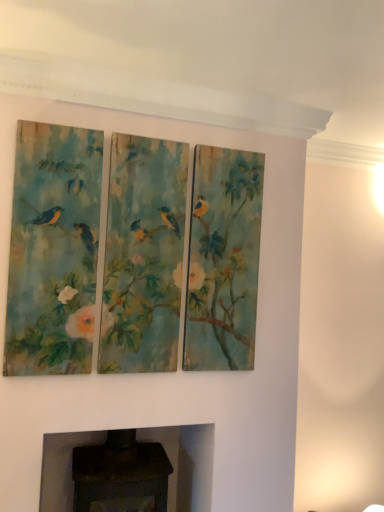
Question: Should I look upward or downward to see dark gray stone fireplace at lower center?

Choices:
 (A) down
 (B) up

Answer: (A)

Question: From a real-world perspective, is textured canvas triptych at center below dark gray stone fireplace at lower center?

Choices:
 (A) no
 (B) yes

Answer: (A)

Question: Is textured canvas triptych at center thinner than dark gray stone fireplace at lower center?

Choices:
 (A) yes
 (B) no

Answer: (A)

Question: Is dark gray stone fireplace at lower center located within textured canvas triptych at center?

Choices:
 (A) no
 (B) yes

Answer: (A)

Question: From the image's perspective, is textured canvas triptych at center located beneath dark gray stone fireplace at lower center?

Choices:
 (A) yes
 (B) no

Answer: (B)

Question: Is textured canvas triptych at center touching dark gray stone fireplace at lower center?

Choices:
 (A) yes
 (B) no

Answer: (B)

Question: Considering the relative sizes of textured canvas triptych at center and dark gray stone fireplace at lower center in the image provided, is textured canvas triptych at center wider than dark gray stone fireplace at lower center?

Choices:
 (A) no
 (B) yes

Answer: (A)

Question: From the image's perspective, is dark gray stone fireplace at lower center on textured canvas triptych at center?

Choices:
 (A) no
 (B) yes

Answer: (A)

Question: Is dark gray stone fireplace at lower center far from textured canvas triptych at center?

Choices:
 (A) yes
 (B) no

Answer: (B)

Question: Considering the relative sizes of dark gray stone fireplace at lower center and textured canvas triptych at center in the image provided, is dark gray stone fireplace at lower center thinner than textured canvas triptych at center?

Choices:
 (A) yes
 (B) no

Answer: (B)

Question: Is dark gray stone fireplace at lower center oriented away from textured canvas triptych at center?

Choices:
 (A) no
 (B) yes

Answer: (A)

Question: Can you confirm if dark gray stone fireplace at lower center is shorter than textured canvas triptych at center?

Choices:
 (A) yes
 (B) no

Answer: (A)

Question: Is dark gray stone fireplace at lower center to the left of textured canvas triptych at center from the viewer's perspective?

Choices:
 (A) no
 (B) yes

Answer: (B)

Question: Is point (26, 267) closer or farther from the camera than point (175, 436)?

Choices:
 (A) farther
 (B) closer

Answer: (B)